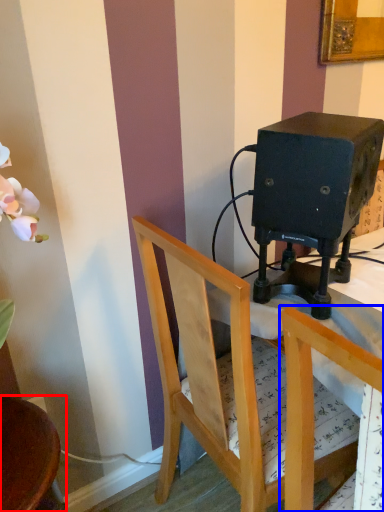
Question: Which object is closer to the camera taking this photo, chair (highlighted by a red box) or chair (highlighted by a blue box)?

Choices:
 (A) chair
 (B) chair

Answer: (B)